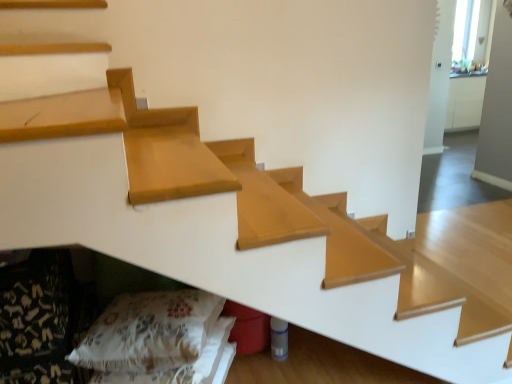
What do you see at coordinates (149, 331) in the screenshot? Image resolution: width=512 pixels, height=384 pixels. I see `floral fabric pillow at lower left` at bounding box center [149, 331].

This screenshot has height=384, width=512. In order to click on floral fabric pillow at lower left in this screenshot , I will do `click(149, 331)`.

Identify the location of floral fabric pillow at lower left. The width and height of the screenshot is (512, 384). (149, 331).